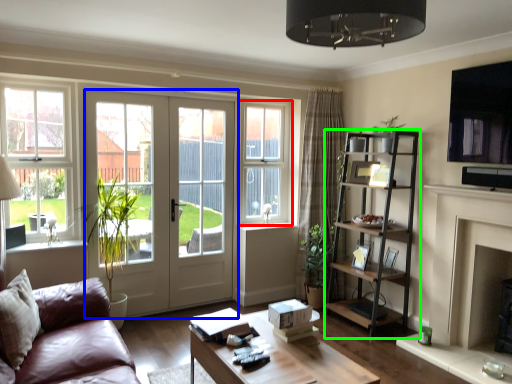
Question: Based on their relative distances, which object is farther from window (highlighted by a red box)? Choose from door (highlighted by a blue box) and shelf (highlighted by a green box).

Choices:
 (A) door
 (B) shelf

Answer: (B)